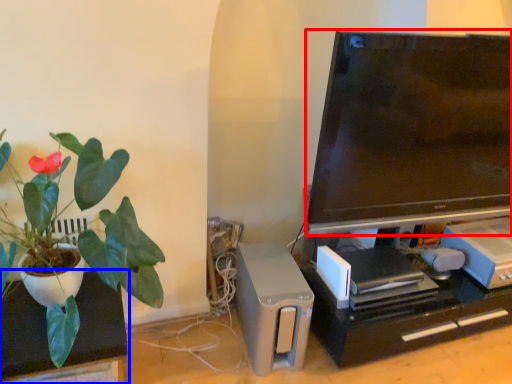
Question: Among these objects, which one is farthest to the camera, television (highlighted by a red box) or furniture (highlighted by a blue box)?

Choices:
 (A) television
 (B) furniture

Answer: (A)